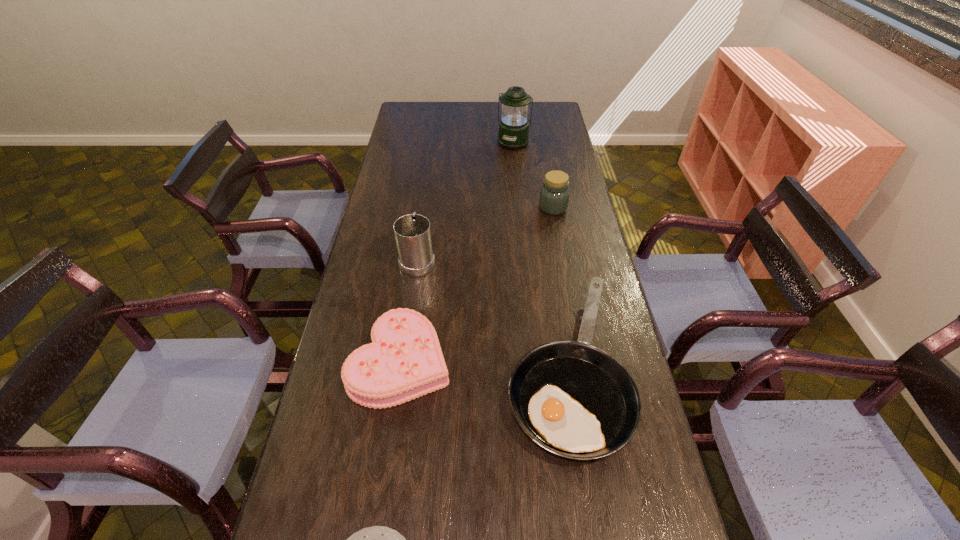
Identify the location of free spot located 0.390m on the side of the mug with the handle. This screenshot has width=960, height=540. (429, 179).

Where is `blank area located on the side of the mug with the handle`? The height and width of the screenshot is (540, 960). blank area located on the side of the mug with the handle is located at coordinates 429,183.

Find the location of a particular element. The height and width of the screenshot is (540, 960). blank space located 0.210m on the front of the second farthest object is located at coordinates (562, 255).

Identify the location of vacant point located on the front of the cake. This screenshot has width=960, height=540. (388, 444).

The width and height of the screenshot is (960, 540). I want to click on free location located on the left of the frying pan, so click(466, 367).

The width and height of the screenshot is (960, 540). What are the coordinates of `mug that is at the left edge` in the screenshot? It's located at (412, 232).

Locate an element on the screen. cake that is at the left edge is located at coordinates (404, 361).

Find the location of a particular element. jar that is at the right edge is located at coordinates (554, 197).

You are a GUI agent. You are given a task and a screenshot of the screen. Output one action in this format:
    pyautogui.click(x=<x>, y=<y>)
    Task: Click on the frying pan located at the right edge
    
    Given the screenshot: What is the action you would take?
    pyautogui.click(x=575, y=400)

This screenshot has height=540, width=960. I want to click on vacant space at the far edge of the desktop, so click(x=451, y=122).